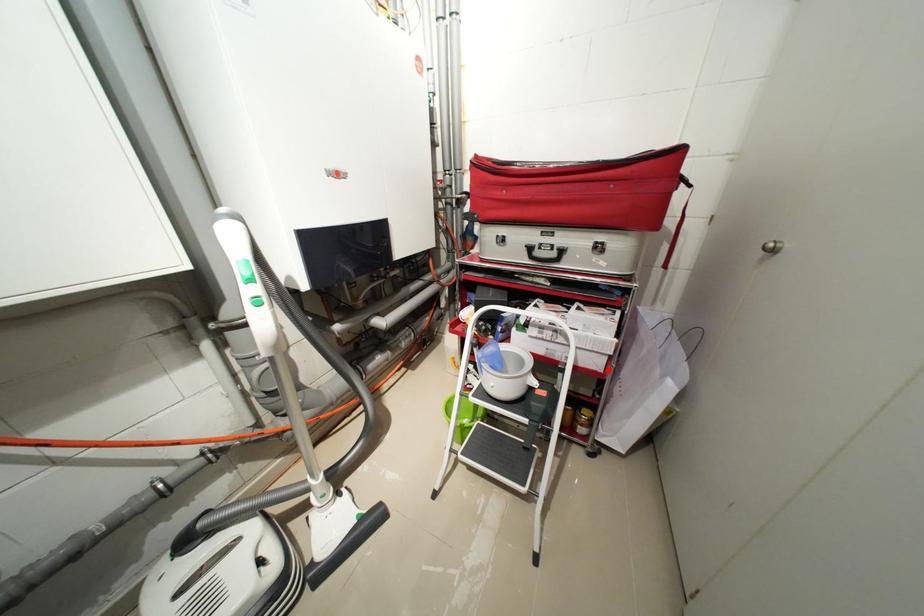
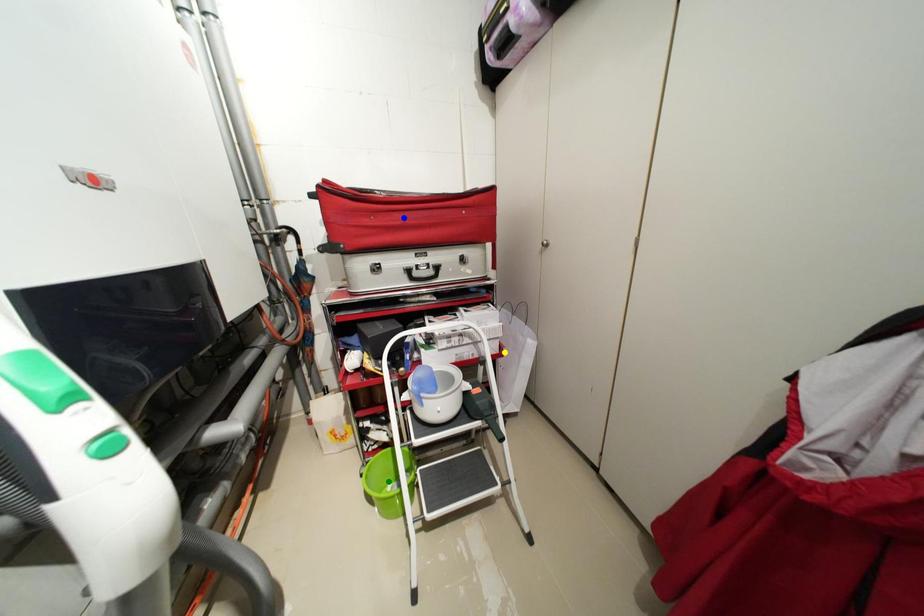
Question: I am providing you with two images of the same scene from different viewpoints. A red point is marked on the first image. You are given multiple points on the second image. Can you choose the point in image 2 that corresponds to the point in image 1?

Choices:
 (A) green point
 (B) yellow point
 (C) blue point

Answer: (B)